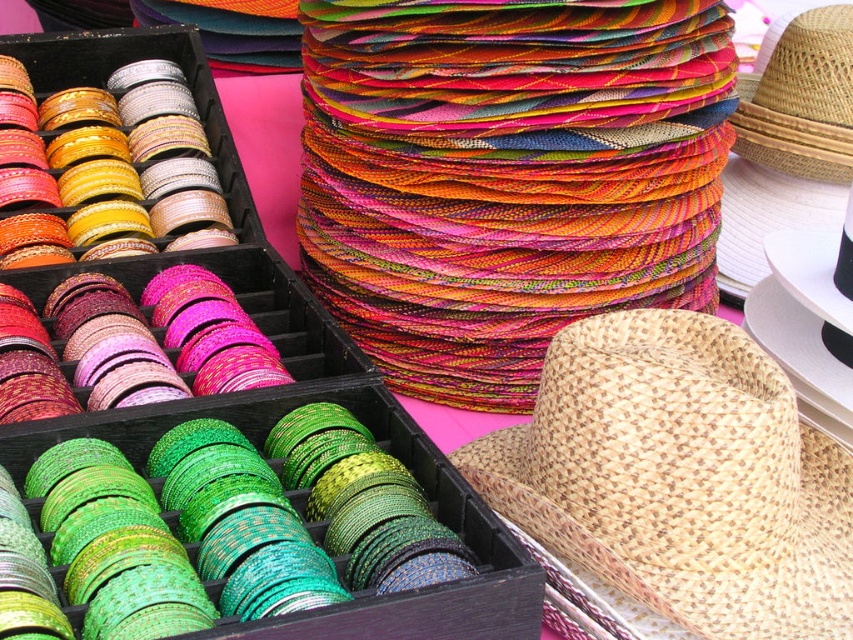
You are at a market and see two natural straw hats. One is labeled as the natural woven straw hat at lower right and the other as the natural straw hat at upper right. Which hat has a larger width?

The natural woven straw hat at lower right might be wider than the natural straw hat at upper right.

You are a vendor at a craft fair and need to place a new display between the natural woven straw hat at lower right and the natural straw hat at upper right. The display requires a minimum of 30 inches of space between them. Do you have enough space?

The distance between the natural woven straw hat at lower right and the natural straw hat at upper right is 29.62 inches, which is less than the required 30 inches. Therefore, there is not enough space for the display.

You are a customer at a craft fair and see the natural woven straw hat at lower right. Where exactly is it located in the image?

The natural woven straw hat at lower right is located at point (x=679, y=477) in the image.